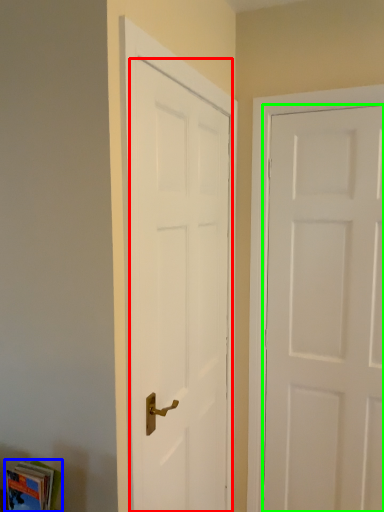
Question: Which object is positioned closest to door (highlighted by a red box)? Select from book (highlighted by a blue box) and door (highlighted by a green box).

Choices:
 (A) book
 (B) door

Answer: (B)